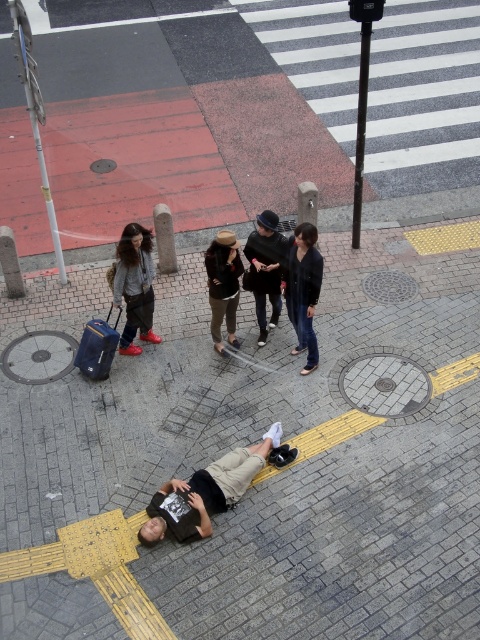
Which of these two, brick pavement at center or black matte skateboard at lower center, stands shorter?

With less height is brick pavement at center.

Looking at this image, can you confirm if brick pavement at center is positioned below black matte skateboard at lower center?

Correct, brick pavement at center is located below black matte skateboard at lower center.

Does point (452, 228) come closer to viewer compared to point (171, 522)?

No, (452, 228) is behind (171, 522).

Where is `brick pavement at center`? This screenshot has width=480, height=640. brick pavement at center is located at coordinates (264, 470).

Can you confirm if brick pavement at center is smaller than black leather jacket at center?

No.

Looking at this image, does brick pavement at center have a greater width compared to black leather jacket at center?

Correct, the width of brick pavement at center exceeds that of black leather jacket at center.

Which is behind, point (220, 364) or point (264, 273)?

Positioned behind is point (220, 364).

The image size is (480, 640). Identify the location of brick pavement at center. (264, 470).

Can you confirm if black matte skateboard at lower center is smaller than black leather jacket at center?

Incorrect, black matte skateboard at lower center is not smaller in size than black leather jacket at center.

Between point (172, 513) and point (278, 288), which one is positioned behind?

The point (278, 288) is more distant.

Find the location of a particular element. The width and height of the screenshot is (480, 640). black matte skateboard at lower center is located at coordinates (x=204, y=492).

Find the location of `black matte skateboard at lower center`. black matte skateboard at lower center is located at coordinates (204, 492).